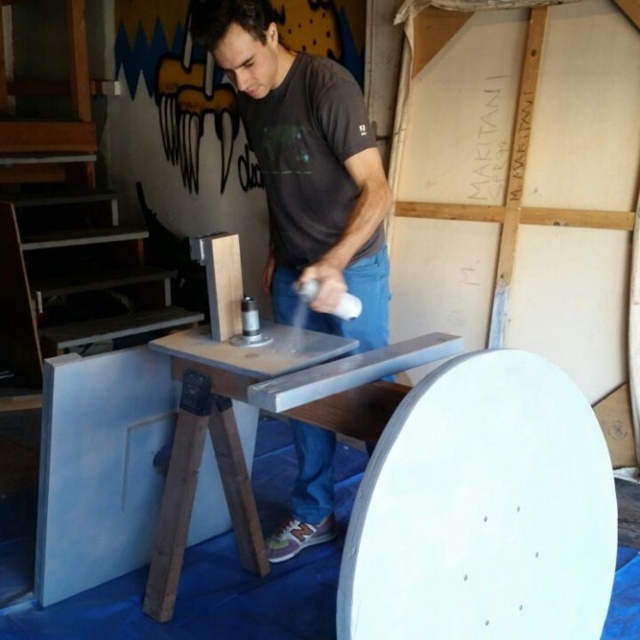
Question: Observing the image, what is the correct spatial positioning of matte gray shirt at center in reference to metallic gray workbench at center?

Choices:
 (A) right
 (B) left

Answer: (A)

Question: In this image, where is matte gray shirt at center located relative to metallic gray workbench at center?

Choices:
 (A) above
 (B) below

Answer: (A)

Question: Which of the following is the closest to the observer?

Choices:
 (A) (356, 154)
 (B) (205, 372)

Answer: (A)

Question: Which point is closer to the camera taking this photo?

Choices:
 (A) (221, 467)
 (B) (369, 230)

Answer: (B)

Question: From the image, what is the correct spatial relationship of matte gray shirt at center in relation to metallic gray workbench at center?

Choices:
 (A) right
 (B) left

Answer: (A)

Question: Which object is farther from the camera taking this photo?

Choices:
 (A) matte gray shirt at center
 (B) metallic gray workbench at center

Answer: (A)